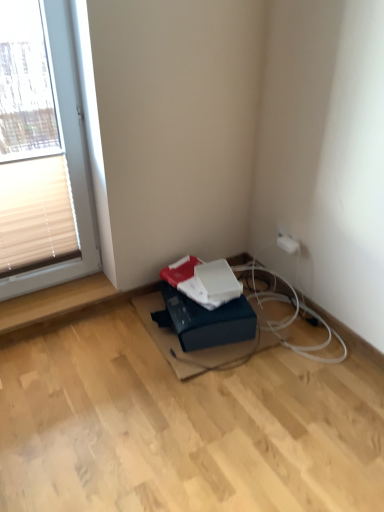
Question: Does blue cardboard box at lower center appear on the left side of white plastic electric outlet at upper right?

Choices:
 (A) no
 (B) yes

Answer: (B)

Question: Could you tell me if blue cardboard box at lower center is turned towards white plastic electric outlet at upper right?

Choices:
 (A) no
 (B) yes

Answer: (A)

Question: Can you confirm if blue cardboard box at lower center is smaller than white plastic electric outlet at upper right?

Choices:
 (A) yes
 (B) no

Answer: (B)

Question: From a real-world perspective, is blue cardboard box at lower center positioned over white plastic electric outlet at upper right based on gravity?

Choices:
 (A) yes
 (B) no

Answer: (B)

Question: From a real-world perspective, is blue cardboard box at lower center physically below white plastic electric outlet at upper right?

Choices:
 (A) no
 (B) yes

Answer: (B)

Question: Is point (253, 295) positioned closer to the camera than point (218, 291)?

Choices:
 (A) farther
 (B) closer

Answer: (A)

Question: Would you say black rubber cable at lower center is to the left or to the right of white matte paperback book at center in the picture?

Choices:
 (A) right
 (B) left

Answer: (B)

Question: Considering the positions of black rubber cable at lower center and white matte paperback book at center in the image, is black rubber cable at lower center bigger or smaller than white matte paperback book at center?

Choices:
 (A) big
 (B) small

Answer: (A)

Question: Do you think black rubber cable at lower center is within white matte paperback book at center, or outside of it?

Choices:
 (A) inside
 (B) outside

Answer: (B)

Question: In terms of size, does black rubber cable at lower center appear bigger or smaller than white plastic electric outlet at upper right?

Choices:
 (A) big
 (B) small

Answer: (A)

Question: From their relative heights in the image, would you say black rubber cable at lower center is taller or shorter than white plastic electric outlet at upper right?

Choices:
 (A) short
 (B) tall

Answer: (A)

Question: Considering the positions of point (259, 300) and point (281, 233), is point (259, 300) closer or farther from the camera than point (281, 233)?

Choices:
 (A) closer
 (B) farther

Answer: (B)

Question: From the image's perspective, relative to white plastic electric outlet at upper right, is black rubber cable at lower center above or below?

Choices:
 (A) above
 (B) below

Answer: (B)

Question: Looking at the image, does blue cardboard box at lower center seem bigger or smaller compared to black rubber cable at lower center?

Choices:
 (A) small
 (B) big

Answer: (B)

Question: In terms of width, does blue cardboard box at lower center look wider or thinner when compared to black rubber cable at lower center?

Choices:
 (A) wide
 (B) thin

Answer: (B)